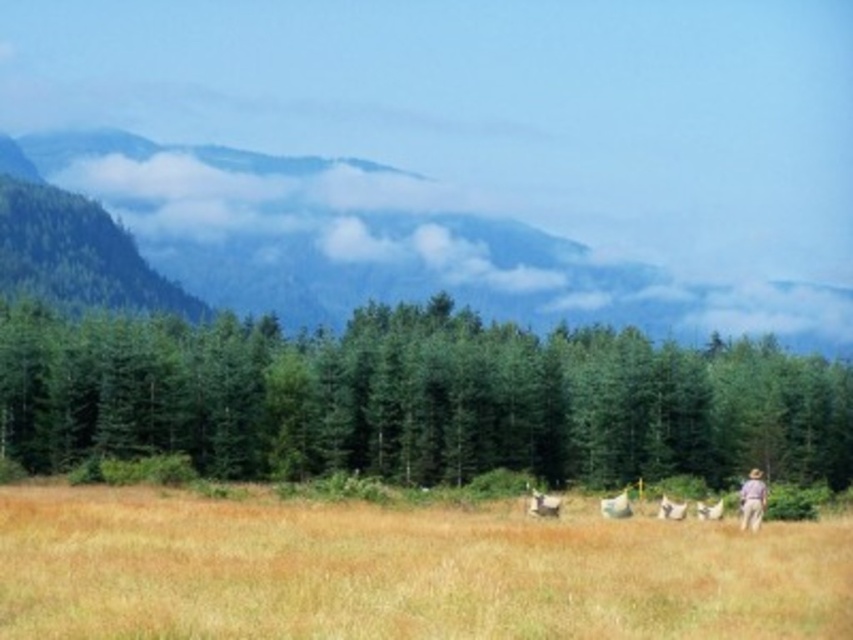
You are standing at the origin point of the image. Which direction should you move to reach the green textured trees at center?

The green textured trees at center are located at point coordinates of 0.623 in the x axis and 0.488 in the y axis. Since the origin point is at the bottom left corner of the image, you should move to the right and slightly upward to reach them.

You are planning to build a small garden shed in the rural landscape. The shed requires a space that is wider than the green forested mountain at upper left. Can the area near the green textured trees at center accommodate the shed?

The green textured trees at center are narrower than the green forested mountain at upper left, so the area near them may not provide enough space for the shed which requires a width greater than the mountain.